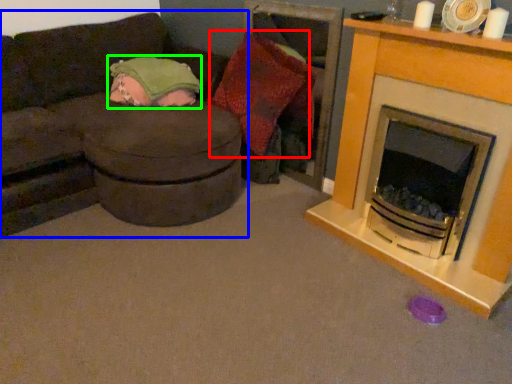
Question: Which is nearer to the pillow (highlighted by a red box)? studio couch (highlighted by a blue box) or blanket (highlighted by a green box).

Choices:
 (A) studio couch
 (B) blanket

Answer: (B)